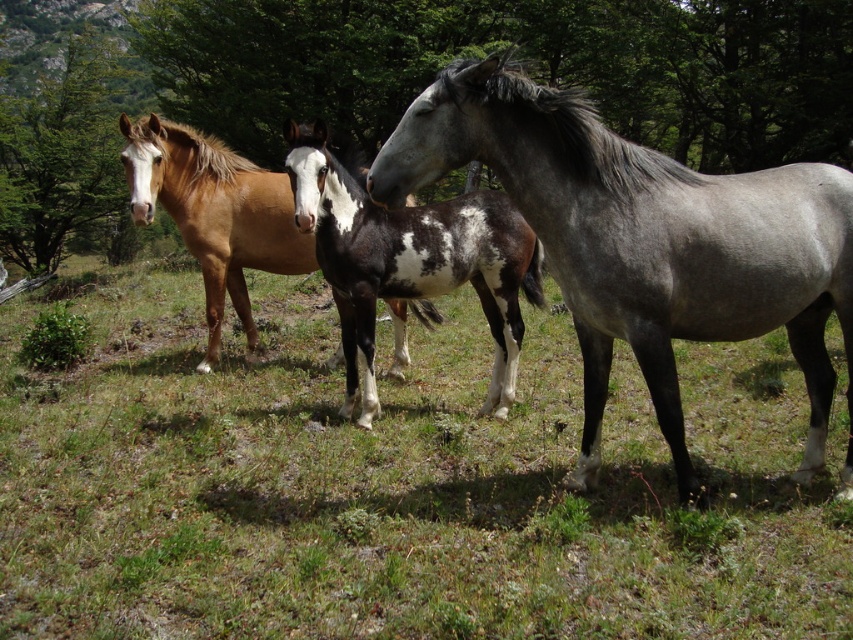
You are a photographer trying to capture a group photo of the gray matte horse at right and the spotted glossy horse at center. Since you want to emphasize their size difference, which horse should you position closer to the camera to make them appear the same size in the photo?

To make the gray matte horse at right and the spotted glossy horse at center appear the same size in the photo, position the smaller spotted glossy horse at center closer to the camera since the gray matte horse at right is larger in size.